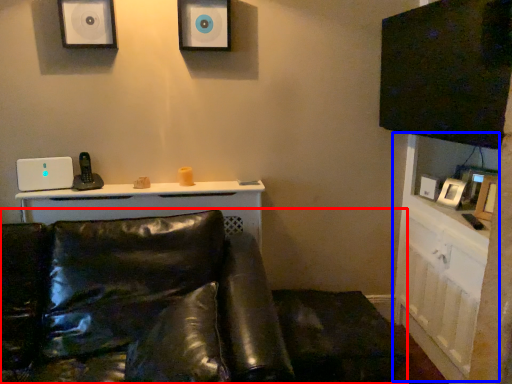
Question: Which point is further to the camera, studio couch (highlighted by a red box) or dresser (highlighted by a blue box)?

Choices:
 (A) studio couch
 (B) dresser

Answer: (B)